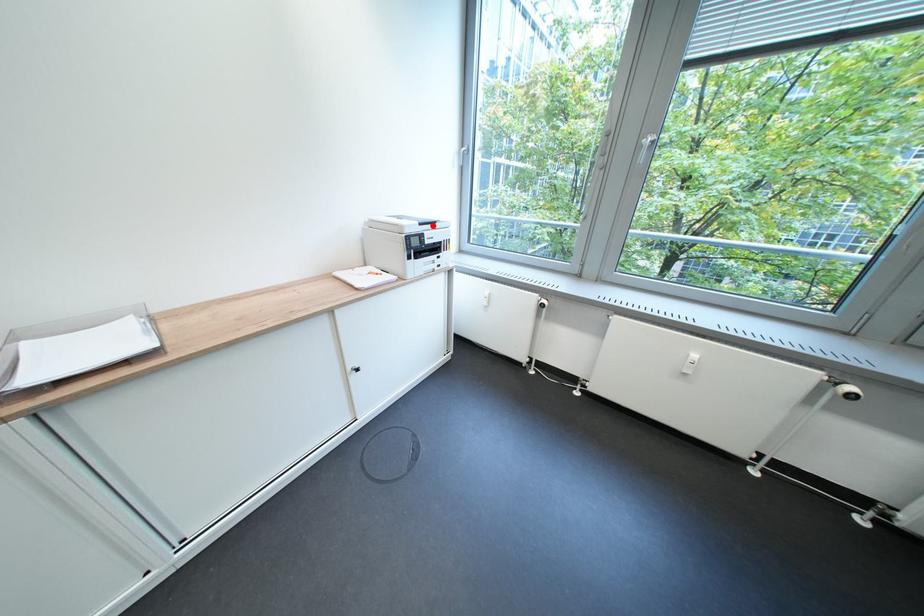
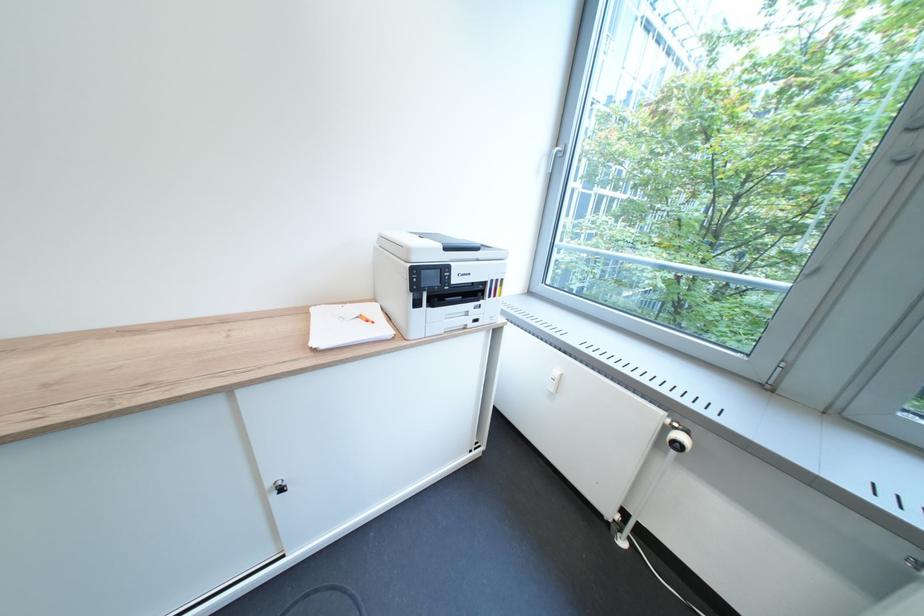
Where in the second image is the point corresponding to the highlighted location from the first image?

(458, 249)